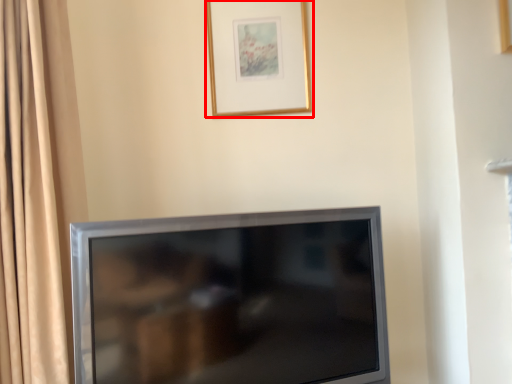
Question: Observing the image, what is the correct spatial positioning of picture frame (annotated by the red box) in reference to television?

Choices:
 (A) right
 (B) left

Answer: (A)